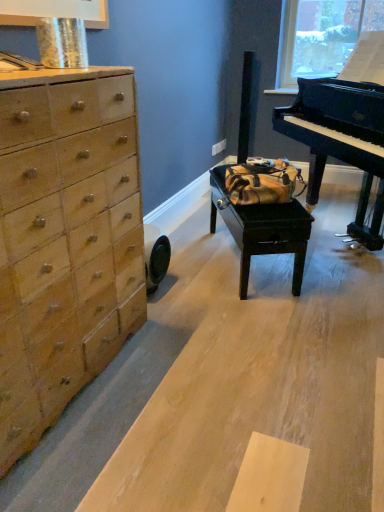
Question: Is wooden table at center positioned with its back to light brown wood chest of drawers at left?

Choices:
 (A) no
 (B) yes

Answer: (B)

Question: From the image's perspective, is wooden table at center located above light brown wood chest of drawers at left?

Choices:
 (A) no
 (B) yes

Answer: (B)

Question: Is wooden table at center in front of light brown wood chest of drawers at left?

Choices:
 (A) no
 (B) yes

Answer: (A)

Question: From a real-world perspective, is wooden table at center physically above light brown wood chest of drawers at left?

Choices:
 (A) yes
 (B) no

Answer: (B)

Question: From a real-world perspective, is wooden table at center physically below light brown wood chest of drawers at left?

Choices:
 (A) yes
 (B) no

Answer: (A)

Question: Based on their positions, is wooden table at center located to the left or right of shiny black piano at right?

Choices:
 (A) left
 (B) right

Answer: (A)

Question: From the image's perspective, is wooden table at center positioned above or below shiny black piano at right?

Choices:
 (A) below
 (B) above

Answer: (A)

Question: Relative to shiny black piano at right, is wooden table at center in front or behind?

Choices:
 (A) front
 (B) behind

Answer: (B)

Question: From a real-world perspective, is wooden table at center physically located above or below shiny black piano at right?

Choices:
 (A) above
 (B) below

Answer: (B)

Question: Which is correct: light brown wood chest of drawers at left is inside wooden table at center, or outside of it?

Choices:
 (A) outside
 (B) inside

Answer: (A)

Question: In terms of height, does light brown wood chest of drawers at left look taller or shorter compared to wooden table at center?

Choices:
 (A) tall
 (B) short

Answer: (A)

Question: Does point [16, 317] appear closer or farther from the camera than point [279, 230]?

Choices:
 (A) farther
 (B) closer

Answer: (B)

Question: Would you say light brown wood chest of drawers at left is to the left or to the right of wooden table at center in the picture?

Choices:
 (A) left
 (B) right

Answer: (A)

Question: Relative to light brown wood chest of drawers at left, is wooden table at center in front or behind?

Choices:
 (A) behind
 (B) front

Answer: (A)

Question: Is wooden table at center wider or thinner than light brown wood chest of drawers at left?

Choices:
 (A) wide
 (B) thin

Answer: (B)